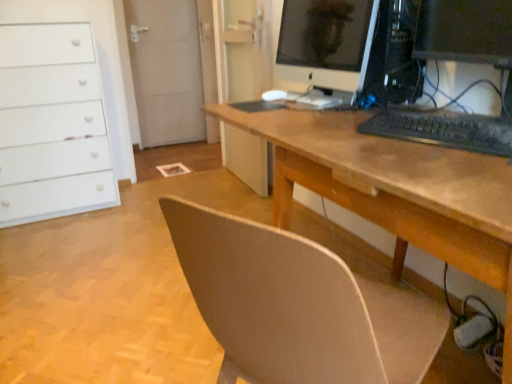
Question: Does satin black monitor at center have a lesser width compared to black matte keyboard at center?

Choices:
 (A) no
 (B) yes

Answer: (A)

Question: Does satin black monitor at center have a smaller size compared to black matte keyboard at center?

Choices:
 (A) no
 (B) yes

Answer: (A)

Question: Are satin black monitor at center and black matte keyboard at center making contact?

Choices:
 (A) yes
 (B) no

Answer: (B)

Question: Is black matte keyboard at center at the back of satin black monitor at center?

Choices:
 (A) yes
 (B) no

Answer: (B)

Question: Does satin black monitor at center have a larger size compared to black matte keyboard at center?

Choices:
 (A) yes
 (B) no

Answer: (A)

Question: From the image's perspective, is satin black monitor at center above or below matte black monitor at upper right?

Choices:
 (A) above
 (B) below

Answer: (A)

Question: Considering the positions of satin black monitor at center and matte black monitor at upper right in the image, is satin black monitor at center wider or thinner than matte black monitor at upper right?

Choices:
 (A) wide
 (B) thin

Answer: (A)

Question: Based on their positions, is satin black monitor at center located to the left or right of matte black monitor at upper right?

Choices:
 (A) right
 (B) left

Answer: (A)

Question: Do you think satin black monitor at center is within matte black monitor at upper right, or outside of it?

Choices:
 (A) outside
 (B) inside

Answer: (A)

Question: Considering the relative positions of wooden desk at center and matte black monitor at upper right in the image provided, is wooden desk at center to the left or to the right of matte black monitor at upper right?

Choices:
 (A) left
 (B) right

Answer: (B)

Question: From a real-world perspective, relative to matte black monitor at upper right, is wooden desk at center vertically above or below?

Choices:
 (A) above
 (B) below

Answer: (B)

Question: Looking at the image, does wooden desk at center seem bigger or smaller compared to matte black monitor at upper right?

Choices:
 (A) big
 (B) small

Answer: (A)

Question: Considering the positions of wooden desk at center and matte black monitor at upper right in the image, is wooden desk at center taller or shorter than matte black monitor at upper right?

Choices:
 (A) tall
 (B) short

Answer: (A)

Question: From the image's perspective, relative to wooden desk at center, is black matte keyboard at center above or below?

Choices:
 (A) below
 (B) above

Answer: (B)

Question: From a real-world perspective, relative to wooden desk at center, is black matte keyboard at center vertically above or below?

Choices:
 (A) below
 (B) above

Answer: (B)